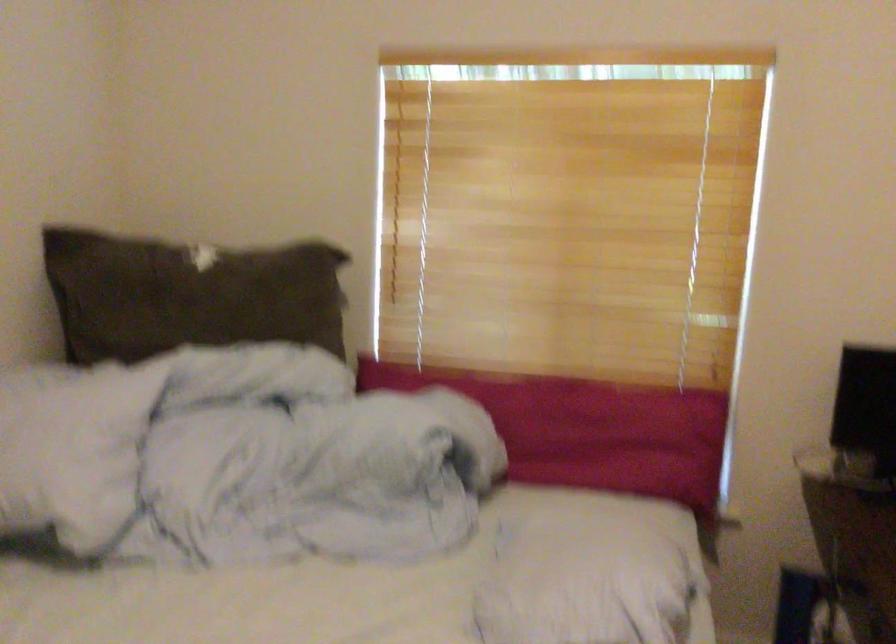
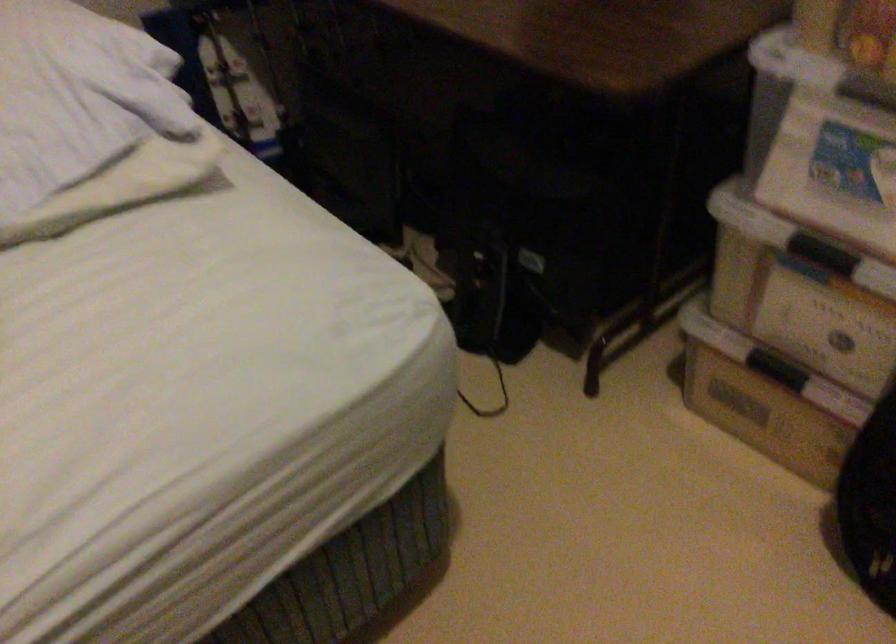
Based on the continuous images, in which direction is the camera rotating?

The camera's rotation is toward right-down.